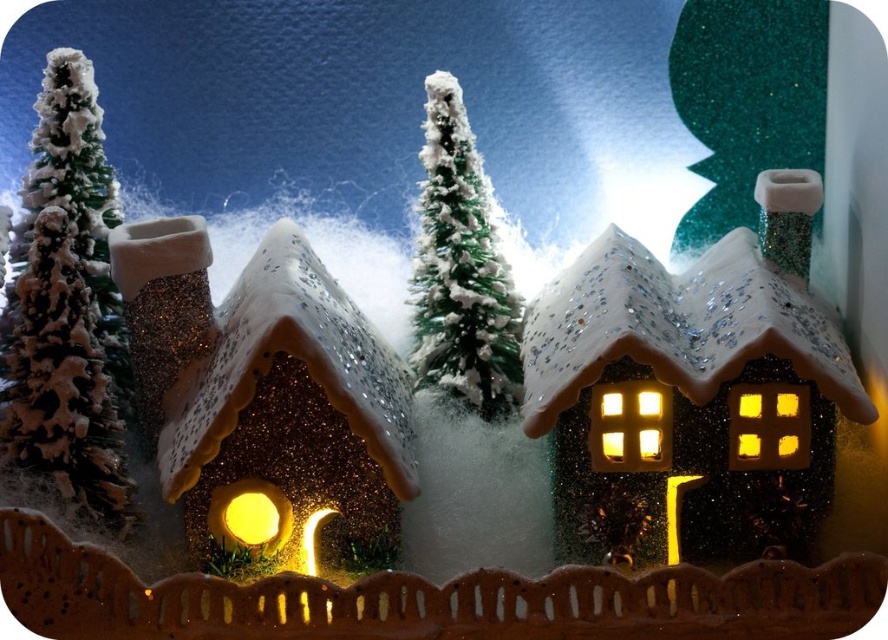
Who is positioned more to the left, green glittery tree at left or green frosted tree at center?

From the viewer's perspective, green glittery tree at left appears more on the left side.

Is green glittery tree at left positioned behind green frosted tree at center?

No, it is not.

Which is behind, point (82, 481) or point (501, 376)?

The point (501, 376) is behind.

Image resolution: width=888 pixels, height=640 pixels. I want to click on green glittery tree at left, so click(x=66, y=305).